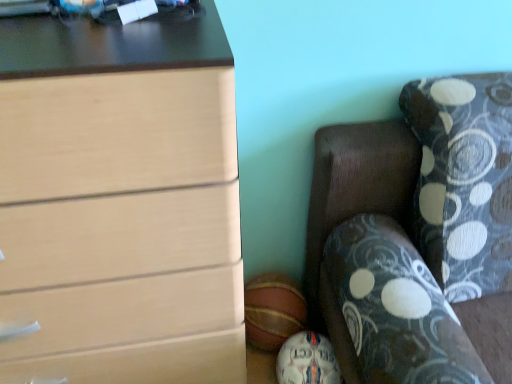
At what (x,y) coordinates should I click in order to perform the action: click on vacant space situated above rubber basketball at lower center, the 1th sports equipment positioned from the top (from a real-world perspective). Please return your answer as a coordinate pair (x, y). Looking at the image, I should click on (272, 294).